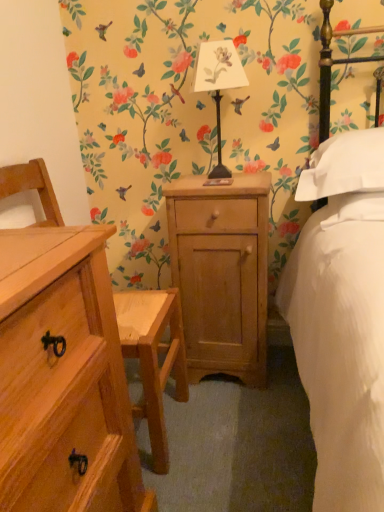
In order to click on white soft pillow at right, the first pillow from the top in this screenshot , I will do `click(344, 166)`.

Where is `natural wood cabinet at center`? This screenshot has height=512, width=384. natural wood cabinet at center is located at coordinates (221, 273).

Describe the element at coordinates (218, 84) in the screenshot. This screenshot has height=512, width=384. I see `metallic black lamp at center` at that location.

Locate an element on the screen. This screenshot has width=384, height=512. metallic black lamp at center is located at coordinates 218,84.

This screenshot has height=512, width=384. I want to click on white soft pillow at right, the first pillow from the top, so click(x=344, y=166).

Is natural wood cabinet at center at the right side of natural wood chest of drawers at left?

Yes.

In the scene shown: Is natural wood cabinet at center not close to natural wood chest of drawers at left?

natural wood cabinet at center is near natural wood chest of drawers at left, not far away.

Is natural wood chest of drawers at left located within natural wood cabinet at center?

No, natural wood chest of drawers at left is not inside natural wood cabinet at center.

Which of these two, natural wood cabinet at center or natural wood chest of drawers at left, is thinner?

With smaller width is natural wood cabinet at center.

Does point (15, 290) come in front of point (238, 293)?

That is True.

From the image's perspective, is natural wood chest of drawers at left under natural wood cabinet at center?

Correct, natural wood chest of drawers at left appears lower than natural wood cabinet at center in the image.

Which is more to the left, natural wood chest of drawers at left or natural wood cabinet at center?

Positioned to the left is natural wood chest of drawers at left.

Is natural wood chest of drawers at left positioned with its back to natural wood cabinet at center?

natural wood chest of drawers at left does not have its back to natural wood cabinet at center.

Is metallic black lamp at center far away from white soft pillow at upper right, placed as the second pillow when sorted from top to bottom?

No, there isn't a large distance between metallic black lamp at center and white soft pillow at upper right, placed as the second pillow when sorted from top to bottom.

From a real-world perspective, which object rests below the other?

From a 3D spatial view, white soft pillow at upper right, placed as the second pillow when sorted from top to bottom, is below.

Find the location of `bedside lamp on the left of white soft pillow at upper right, placed as the second pillow when sorted from top to bottom`. bedside lamp on the left of white soft pillow at upper right, placed as the second pillow when sorted from top to bottom is located at coordinates (218, 84).

How far apart are metallic black lamp at center and natural wood cabinet at center?

metallic black lamp at center and natural wood cabinet at center are 18.25 inches apart.

In terms of height, does metallic black lamp at center look taller or shorter compared to natural wood cabinet at center?

Considering their sizes, metallic black lamp at center has less height than natural wood cabinet at center.

From the image's perspective, is metallic black lamp at center on top of natural wood cabinet at center?

Correct, metallic black lamp at center appears higher than natural wood cabinet at center in the image.

Considering the relative sizes of metallic black lamp at center and natural wood cabinet at center in the image provided, is metallic black lamp at center thinner than natural wood cabinet at center?

Indeed, metallic black lamp at center has a lesser width compared to natural wood cabinet at center.

From a real-world perspective, which is physically above, metallic black lamp at center or white soft pillow at right, placed as the 2th pillow when sorted from bottom to top?

metallic black lamp at center, from a real-world perspective.

From the image's perspective, between metallic black lamp at center and white soft pillow at right, the first pillow from the top, which one is located above?

metallic black lamp at center.

Who is bigger, metallic black lamp at center or white soft pillow at right, the first pillow from the top?

With larger size is white soft pillow at right, the first pillow from the top.

Based on the photo, would you say metallic black lamp at center is a long distance from white soft pillow at right, the first pillow from the top?

metallic black lamp at center is actually quite close to white soft pillow at right, the first pillow from the top.

Is natural wood chest of drawers at left shorter than white soft pillow at upper right, placed as the second pillow when sorted from top to bottom?

In fact, natural wood chest of drawers at left may be taller than white soft pillow at upper right, placed as the second pillow when sorted from top to bottom.

Is natural wood chest of drawers at left located outside white soft pillow at upper right, which is the 1th pillow in bottom-to-top order?

natural wood chest of drawers at left lies outside white soft pillow at upper right, which is the 1th pillow in bottom-to-top order,'s area.

Based on the photo, from a real-world perspective, is natural wood chest of drawers at left beneath white soft pillow at upper right, placed as the second pillow when sorted from top to bottom?

Yes, from a real-world perspective, natural wood chest of drawers at left is under white soft pillow at upper right, placed as the second pillow when sorted from top to bottom.

How different are the orientations of natural wood chest of drawers at left and white soft pillow at upper right, placed as the second pillow when sorted from top to bottom, in degrees?

The facing directions of natural wood chest of drawers at left and white soft pillow at upper right, placed as the second pillow when sorted from top to bottom, are 89.6 degrees apart.

Would you say white soft pillow at right, the first pillow from the top, is inside or outside natural wood cabinet at center?

white soft pillow at right, the first pillow from the top, is outside natural wood cabinet at center.

Is white soft pillow at right, placed as the 2th pillow when sorted from bottom to top, to the right of natural wood cabinet at center from the viewer's perspective?

Correct, you'll find white soft pillow at right, placed as the 2th pillow when sorted from bottom to top, to the right of natural wood cabinet at center.

Can you confirm if white soft pillow at right, placed as the 2th pillow when sorted from bottom to top, is wider than natural wood cabinet at center?

Yes.

From a real-world perspective, which object stands above the other?

white soft pillow at right, placed as the 2th pillow when sorted from bottom to top, from a real-world perspective.

The image size is (384, 512). Find the location of `chest of drawers on the left of natural wood cabinet at center`. chest of drawers on the left of natural wood cabinet at center is located at coordinates (63, 378).

Locate an element on the screen. The height and width of the screenshot is (512, 384). chest of drawers in front of the natural wood cabinet at center is located at coordinates (63, 378).

Estimate the real-world distances between objects in this image. Which object is further from natural wood cabinet at center, white soft pillow at upper right, which is the 1th pillow in bottom-to-top order, or white soft pillow at right, the first pillow from the top?

white soft pillow at upper right, which is the 1th pillow in bottom-to-top order, lies further to natural wood cabinet at center than the other object.

Based on their spatial positions, is white soft pillow at right, placed as the 2th pillow when sorted from bottom to top, or natural wood chest of drawers at left further from natural wood cabinet at center?

natural wood chest of drawers at left.

Based on their spatial positions, is natural wood chest of drawers at left or metallic black lamp at center further from white soft pillow at right, the first pillow from the top?

Among the two, natural wood chest of drawers at left is located further to white soft pillow at right, the first pillow from the top.

Looking at the image, which one is located closer to natural wood cabinet at center, metallic black lamp at center or white soft pillow at right, the first pillow from the top?

The object closer to natural wood cabinet at center is white soft pillow at right, the first pillow from the top.

When comparing their distances from white soft pillow at right, the first pillow from the top, does metallic black lamp at center or white soft pillow at upper right, which is the 1th pillow in bottom-to-top order, seem further?

metallic black lamp at center lies further to white soft pillow at right, the first pillow from the top, than the other object.

Based on their spatial positions, is white soft pillow at upper right, placed as the second pillow when sorted from top to bottom, or natural wood chest of drawers at left further from metallic black lamp at center?

natural wood chest of drawers at left is further to metallic black lamp at center.

Which object lies further to the anchor point natural wood chest of drawers at left, white soft pillow at right, placed as the 2th pillow when sorted from bottom to top, or white soft pillow at upper right, placed as the second pillow when sorted from top to bottom?

white soft pillow at right, placed as the 2th pillow when sorted from bottom to top.

When comparing their distances from metallic black lamp at center, does white soft pillow at upper right, which is the 1th pillow in bottom-to-top order, or white soft pillow at right, placed as the 2th pillow when sorted from bottom to top, seem closer?

white soft pillow at right, placed as the 2th pillow when sorted from bottom to top, is closer to metallic black lamp at center.

This screenshot has width=384, height=512. Find the location of `pillow between natural wood cabinet at center and white soft pillow at upper right, which is the 1th pillow in bottom-to-top order, from left to right`. pillow between natural wood cabinet at center and white soft pillow at upper right, which is the 1th pillow in bottom-to-top order, from left to right is located at coordinates (344, 166).

Locate an element on the screen. Image resolution: width=384 pixels, height=512 pixels. pillow between metallic black lamp at center and white soft pillow at upper right, placed as the second pillow when sorted from top to bottom is located at coordinates (344, 166).

The width and height of the screenshot is (384, 512). Find the location of `pillow situated between natural wood chest of drawers at left and white soft pillow at upper right, which is the 1th pillow in bottom-to-top order, from left to right`. pillow situated between natural wood chest of drawers at left and white soft pillow at upper right, which is the 1th pillow in bottom-to-top order, from left to right is located at coordinates [x=344, y=166].

What are the coordinates of `nightstand positioned between natural wood chest of drawers at left and metallic black lamp at center from near to far` in the screenshot? It's located at (221, 273).